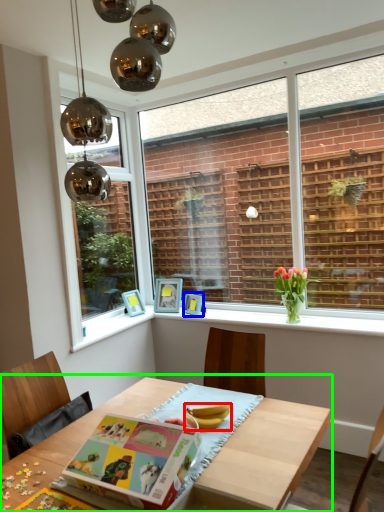
Question: Which object is the closest to the banana (highlighted by a red box)? Choose among these: picture frame (highlighted by a blue box) or table (highlighted by a green box).

Choices:
 (A) picture frame
 (B) table

Answer: (B)